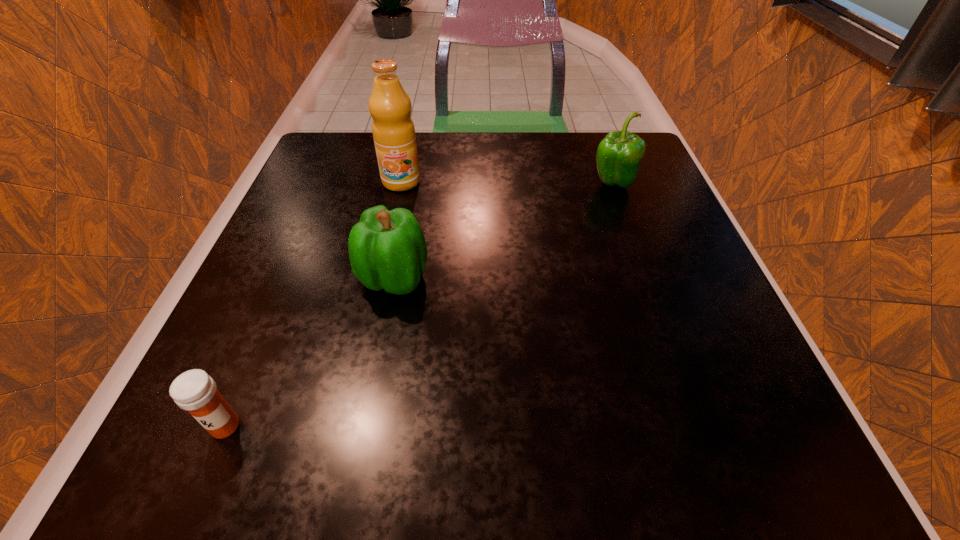
Locate an element on the screen. free point between the nearest object and the third farthest object is located at coordinates (309, 352).

Identify the location of the second closest object to the tallest object. (619, 154).

This screenshot has width=960, height=540. I want to click on object that stands as the second closest to the fruit juice, so click(x=619, y=154).

Image resolution: width=960 pixels, height=540 pixels. What are the coordinates of `free space in the image that satisfies the following two spatial constraints: 1. on the front label of the right bell pepper; 2. on the right side of the tallest object` in the screenshot? It's located at (400, 184).

This screenshot has width=960, height=540. Identify the location of vacant space that satisfies the following two spatial constraints: 1. on the front label of the fruit juice; 2. on the left side of the right bell pepper. (400, 184).

Where is `free spot that satisfies the following two spatial constraints: 1. on the front label of the fruit juice; 2. on the right side of the nearer bell pepper`? The width and height of the screenshot is (960, 540). free spot that satisfies the following two spatial constraints: 1. on the front label of the fruit juice; 2. on the right side of the nearer bell pepper is located at coordinates (x=380, y=279).

You are a GUI agent. You are given a task and a screenshot of the screen. Output one action in this format:
    pyautogui.click(x=<x>, y=<y>)
    Task: Click on the blank space that satisfies the following two spatial constraints: 1. on the front label of the second nearest object; 2. on the left side of the tallest object
    This screenshot has height=540, width=960.
    Given the screenshot: What is the action you would take?
    pyautogui.click(x=380, y=279)